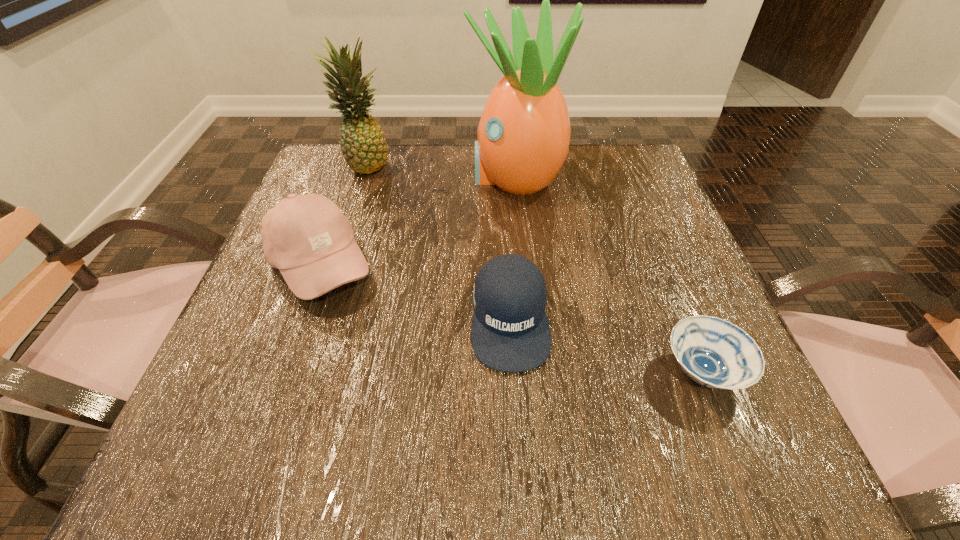
Locate an element on the screen. The image size is (960, 540). the taller pineapple is located at coordinates (523, 136).

Image resolution: width=960 pixels, height=540 pixels. What are the coordinates of `the right pineapple` in the screenshot? It's located at 523,136.

Find the location of a particular element. This screenshot has width=960, height=540. the second tallest object is located at coordinates (362, 141).

Identify the location of the shorter pineapple. (362, 141).

I want to click on the left baseball cap, so click(x=307, y=237).

Identify the location of the taller baseball cap. The image size is (960, 540). (307, 237).

Locate an element on the screen. The image size is (960, 540). the right baseball cap is located at coordinates (510, 332).

Where is `the shorter baseball cap`? the shorter baseball cap is located at coordinates tap(510, 332).

Identify the location of soup bowl. (715, 353).

What are the coordinates of `the shortest object` in the screenshot? It's located at (715, 353).